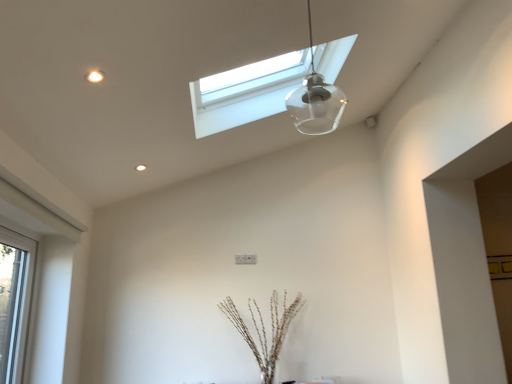
Locate an element on the screen. This screenshot has height=384, width=512. brown textured sticks at center is located at coordinates (264, 329).

This screenshot has width=512, height=384. I want to click on clear glass window at left, the second window in the right-to-left sequence, so click(x=14, y=301).

Is brown textured sticks at center positioned beyond the bounds of transparent glass window at upper center, the first window positioned from the right?

Yes.

From a real-world perspective, is brown textured sticks at center physically located above or below transparent glass window at upper center, arranged as the second window when viewed from the left?

brown textured sticks at center is situated lower than transparent glass window at upper center, arranged as the second window when viewed from the left, in the real world.

Does point (272, 341) come closer to viewer compared to point (217, 119)?

No, (272, 341) is further to viewer.

Which of these two, brown textured sticks at center or transparent glass window at upper center, arranged as the second window when viewed from the left, is smaller?

brown textured sticks at center is smaller.

From a real-world perspective, which object stands above the other?

In real-world perspective, transparent glass pendant light at upper center is above.

Between brown textured sticks at center and transparent glass pendant light at upper center, which one has less height?

transparent glass pendant light at upper center.

Is brown textured sticks at center directly adjacent to transparent glass pendant light at upper center?

No, brown textured sticks at center is not touching transparent glass pendant light at upper center.

Who is shorter, clear glass window at left, the second window in the right-to-left sequence, or transparent glass pendant light at upper center?

transparent glass pendant light at upper center.

From the image's perspective, is clear glass window at left, the 2th window in the top-to-bottom sequence, positioned above or below transparent glass pendant light at upper center?

clear glass window at left, the 2th window in the top-to-bottom sequence, is below transparent glass pendant light at upper center.

Locate an element on the screen. This screenshot has width=512, height=384. lamp in front of the clear glass window at left, which is the 1th window from bottom to top is located at coordinates (315, 100).

What's the angular difference between clear glass window at left, the first window viewed from the left, and transparent glass pendant light at upper center's facing directions?

The facing directions of clear glass window at left, the first window viewed from the left, and transparent glass pendant light at upper center are 0.111 degrees apart.

Is point (335, 93) closer to camera compared to point (6, 246)?

That is True.

What's the angular difference between transparent glass pendant light at upper center and clear glass window at left, the second window in the right-to-left sequence,'s facing directions?

They differ by 0.111 degrees in their facing directions.

Is transparent glass pendant light at upper center surrounding clear glass window at left, the second window in the right-to-left sequence?

No, clear glass window at left, the second window in the right-to-left sequence, is not inside transparent glass pendant light at upper center.

Considering the sizes of objects transparent glass window at upper center, which ranks as the first window in top-to-bottom order, and clear glass window at left, which is the 1th window from bottom to top, in the image provided, who is bigger, transparent glass window at upper center, which ranks as the first window in top-to-bottom order, or clear glass window at left, which is the 1th window from bottom to top,?

transparent glass window at upper center, which ranks as the first window in top-to-bottom order, is bigger.

Which of these two, transparent glass window at upper center, which ranks as the first window in top-to-bottom order, or clear glass window at left, the second window in the right-to-left sequence, stands shorter?

Standing shorter between the two is transparent glass window at upper center, which ranks as the first window in top-to-bottom order.

Where is `window below the transparent glass window at upper center, which ranks as the first window in top-to-bottom order (from the image's perspective)`? Image resolution: width=512 pixels, height=384 pixels. window below the transparent glass window at upper center, which ranks as the first window in top-to-bottom order (from the image's perspective) is located at coordinates (14, 301).

Could you tell me if transparent glass window at upper center, which ranks as the first window in top-to-bottom order, is turned towards clear glass window at left, the second window in the right-to-left sequence?

No, transparent glass window at upper center, which ranks as the first window in top-to-bottom order, is not facing towards clear glass window at left, the second window in the right-to-left sequence.

Is brown textured sticks at center aimed at clear glass window at left, the first window viewed from the left?

No, brown textured sticks at center is not turned towards clear glass window at left, the first window viewed from the left.

Based on the photo, can you confirm if brown textured sticks at center is thinner than clear glass window at left, the 2th window in the top-to-bottom sequence?

In fact, brown textured sticks at center might be wider than clear glass window at left, the 2th window in the top-to-bottom sequence.

Is clear glass window at left, the 2th window in the top-to-bottom sequence, inside brown textured sticks at center?

No, brown textured sticks at center does not contain clear glass window at left, the 2th window in the top-to-bottom sequence.

Between clear glass window at left, which is the 1th window from bottom to top, and brown textured sticks at center, which one has less height?

brown textured sticks at center is shorter.

Can you confirm if clear glass window at left, the second window in the right-to-left sequence, is wider than brown textured sticks at center?

No, clear glass window at left, the second window in the right-to-left sequence, is not wider than brown textured sticks at center.

Which is more to the left, clear glass window at left, which is the 1th window from bottom to top, or brown textured sticks at center?

Positioned to the left is clear glass window at left, which is the 1th window from bottom to top.

Is point (2, 240) positioned in front of point (273, 370)?

Yes.

Locate an element on the screen. This screenshot has height=384, width=512. the 2nd window above the brown textured sticks at center (from a real-world perspective) is located at coordinates (246, 92).

Locate an element on the screen. plant behind the transparent glass pendant light at upper center is located at coordinates (264, 329).

In the scene shown: Based on their spatial positions, is transparent glass pendant light at upper center or brown textured sticks at center closer to transparent glass window at upper center, which ranks as the first window in top-to-bottom order?

transparent glass pendant light at upper center is closer to transparent glass window at upper center, which ranks as the first window in top-to-bottom order.

Which object lies further to the anchor point transparent glass pendant light at upper center, transparent glass window at upper center, arranged as the second window when viewed from the left, or brown textured sticks at center?

Based on the image, brown textured sticks at center appears to be further to transparent glass pendant light at upper center.

Based on their spatial positions, is transparent glass window at upper center, the first window positioned from the right, or transparent glass pendant light at upper center closer to brown textured sticks at center?

transparent glass pendant light at upper center is positioned closer to the anchor brown textured sticks at center.

From the image, which object appears to be farther from transparent glass pendant light at upper center, brown textured sticks at center or clear glass window at left, which is the 1th window from bottom to top?

The object further to transparent glass pendant light at upper center is clear glass window at left, which is the 1th window from bottom to top.

Looking at the image, which one is located further to clear glass window at left, the second window in the right-to-left sequence, transparent glass pendant light at upper center or brown textured sticks at center?

transparent glass pendant light at upper center.

When comparing their distances from transparent glass pendant light at upper center, does transparent glass window at upper center, the second window when ordered from bottom to top, or clear glass window at left, the first window viewed from the left, seem further?

clear glass window at left, the first window viewed from the left, lies further to transparent glass pendant light at upper center than the other object.

Considering their positions, is transparent glass window at upper center, which ranks as the first window in top-to-bottom order, positioned further to clear glass window at left, the first window viewed from the left, than transparent glass pendant light at upper center?

transparent glass pendant light at upper center is further to clear glass window at left, the first window viewed from the left.

From the image, which object appears to be nearer to brown textured sticks at center, clear glass window at left, the second window in the right-to-left sequence, or transparent glass pendant light at upper center?

The object closer to brown textured sticks at center is clear glass window at left, the second window in the right-to-left sequence.

Find the location of `lamp between transparent glass window at upper center, arranged as the second window when viewed from the left, and brown textured sticks at center from top to bottom`. lamp between transparent glass window at upper center, arranged as the second window when viewed from the left, and brown textured sticks at center from top to bottom is located at coordinates (315, 100).

This screenshot has width=512, height=384. Find the location of `window between clear glass window at left, the second window in the right-to-left sequence, and transparent glass pendant light at upper center, in the horizontal direction`. window between clear glass window at left, the second window in the right-to-left sequence, and transparent glass pendant light at upper center, in the horizontal direction is located at coordinates (246, 92).

The height and width of the screenshot is (384, 512). Identify the location of window between transparent glass window at upper center, arranged as the second window when viewed from the left, and brown textured sticks at center from top to bottom. (14, 301).

Where is `plant between clear glass window at left, the 2th window in the top-to-bottom sequence, and transparent glass pendant light at upper center`? This screenshot has width=512, height=384. plant between clear glass window at left, the 2th window in the top-to-bottom sequence, and transparent glass pendant light at upper center is located at coordinates (264, 329).